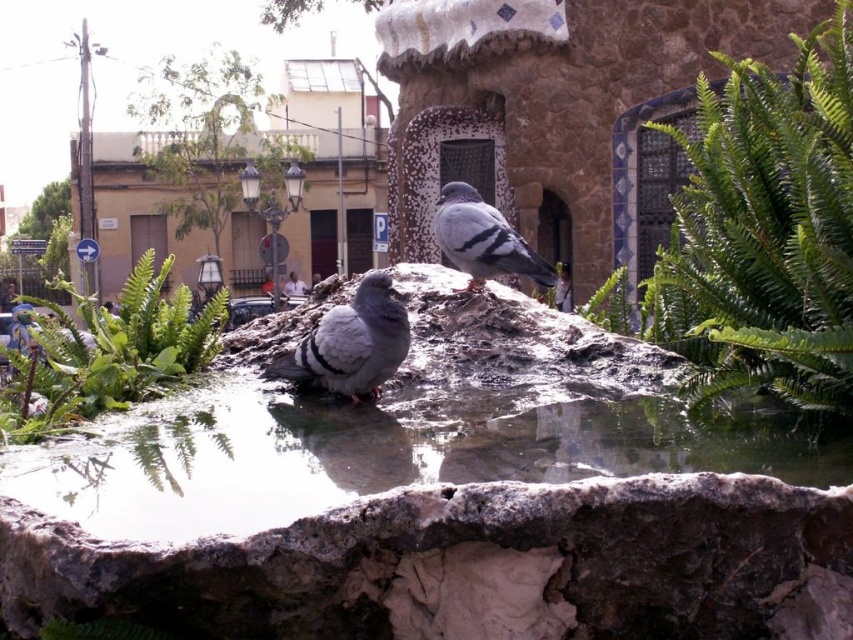
You are standing in the park and see the clear water at center and the white fabric couple at center. Which object is closer to you?

The clear water at center is closer to you because it is in front of the white fabric couple at center.